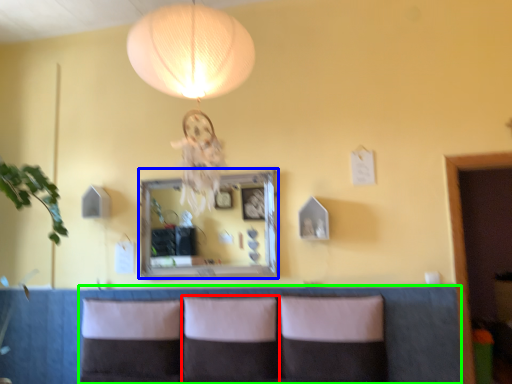
Question: Estimate the real-world distances between objects in this image. Which object is farther from pillow (highlighted by a red box), mirror (highlighted by a blue box) or couch (highlighted by a green box)?

Choices:
 (A) mirror
 (B) couch

Answer: (A)